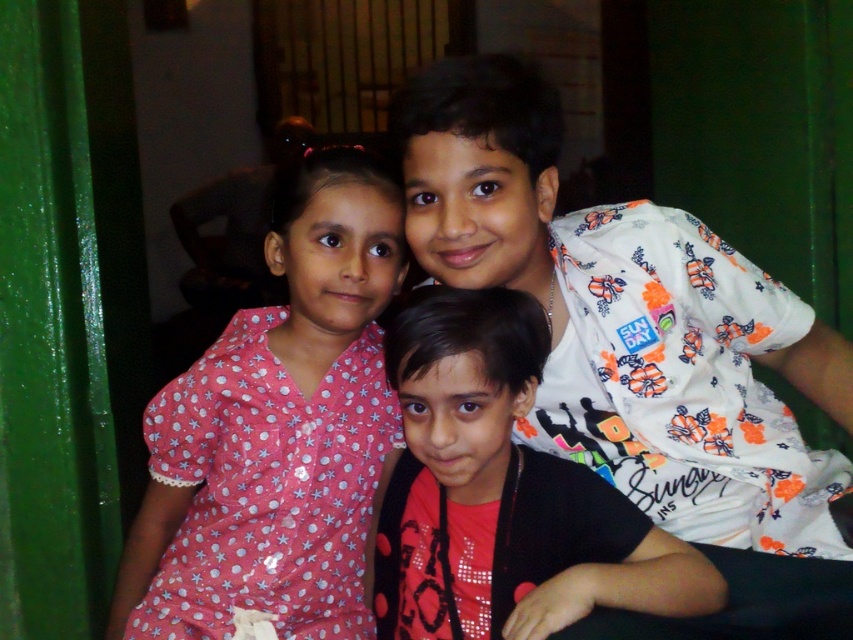
Question: Estimate the real-world distances between objects in this image. Which object is farther from the pink dotted dress at left?

Choices:
 (A) white floral shirt at upper right
 (B) matte floral shirt at center

Answer: (A)

Question: Which object is positioned farthest from the white floral shirt at upper right?

Choices:
 (A) matte floral shirt at center
 (B) pink dotted dress at left

Answer: (B)

Question: Can you confirm if white floral shirt at upper right is thinner than matte floral shirt at center?

Choices:
 (A) yes
 (B) no

Answer: (B)

Question: Which object appears closest to the camera in this image?

Choices:
 (A) matte floral shirt at center
 (B) pink dotted dress at left
 (C) white floral shirt at upper right

Answer: (A)

Question: Does pink dotted dress at left have a lesser width compared to matte floral shirt at center?

Choices:
 (A) no
 (B) yes

Answer: (A)

Question: Where is white floral shirt at upper right located in relation to pink dotted dress at left in the image?

Choices:
 (A) left
 (B) right

Answer: (B)